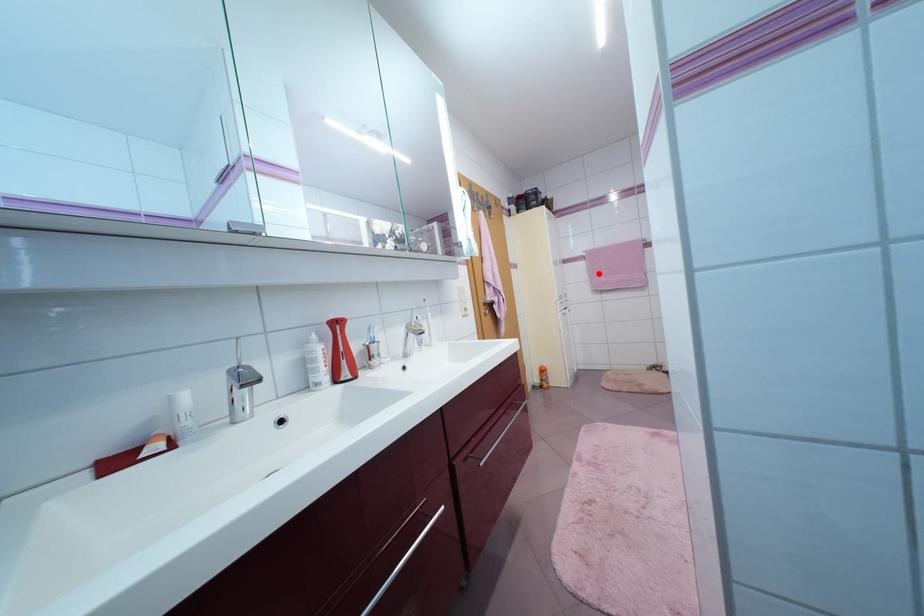
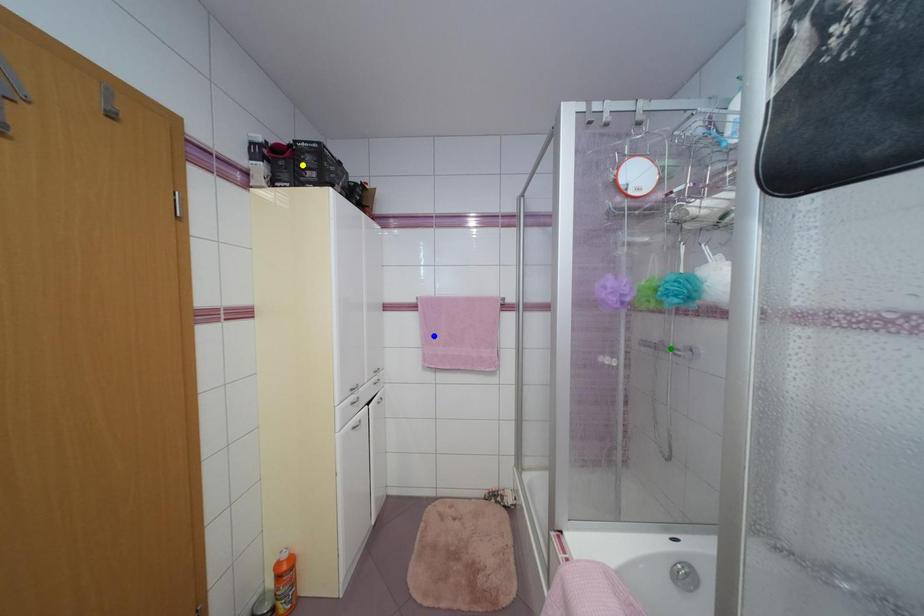
Question: I am providing you with two images of the same scene from different viewpoints. A red point is marked on the first image. You are given multiple points on the second image. Which point in image 2 is actually the same real-world point as the red point in image 1?

Choices:
 (A) green point
 (B) blue point
 (C) yellow point

Answer: (B)